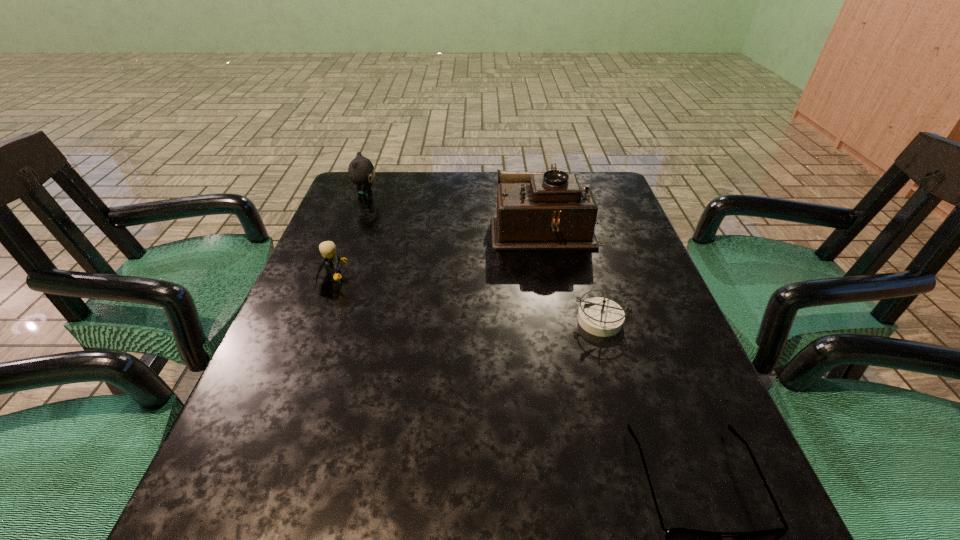
Locate an element on the screen. The height and width of the screenshot is (540, 960). blank space at the near edge of the desktop is located at coordinates (585, 497).

At what (x,y) coordinates should I click in order to perform the action: click on free spot at the left edge of the desktop. Please return your answer as a coordinate pair (x, y). Looking at the image, I should click on (352, 218).

Locate an element on the screen. The height and width of the screenshot is (540, 960). free space at the right edge of the desktop is located at coordinates (697, 380).

Image resolution: width=960 pixels, height=540 pixels. I want to click on free space at the far right corner, so click(x=619, y=194).

Locate an element on the screen. This screenshot has width=960, height=540. vacant region at the near right corner is located at coordinates (720, 532).

Locate an element on the screen. free point between the Lego and the second tallest object is located at coordinates (349, 238).

What are the coordinates of `free space that is in between the Lego and the tallest object` in the screenshot? It's located at (440, 252).

Image resolution: width=960 pixels, height=540 pixels. In order to click on blank region between the fourth farthest object and the kitten in this screenshot , I will do `click(483, 258)`.

The image size is (960, 540). Find the location of `vacant area that lies between the phonograph_record and the fourth farthest object`. vacant area that lies between the phonograph_record and the fourth farthest object is located at coordinates (572, 273).

Identify the location of free point between the compass and the kitten. Image resolution: width=960 pixels, height=540 pixels. (483, 258).